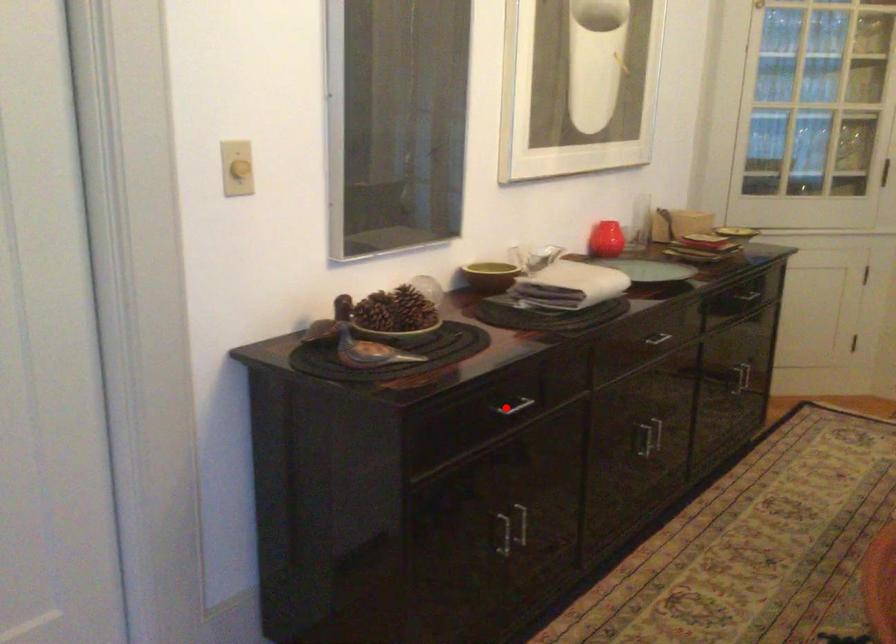
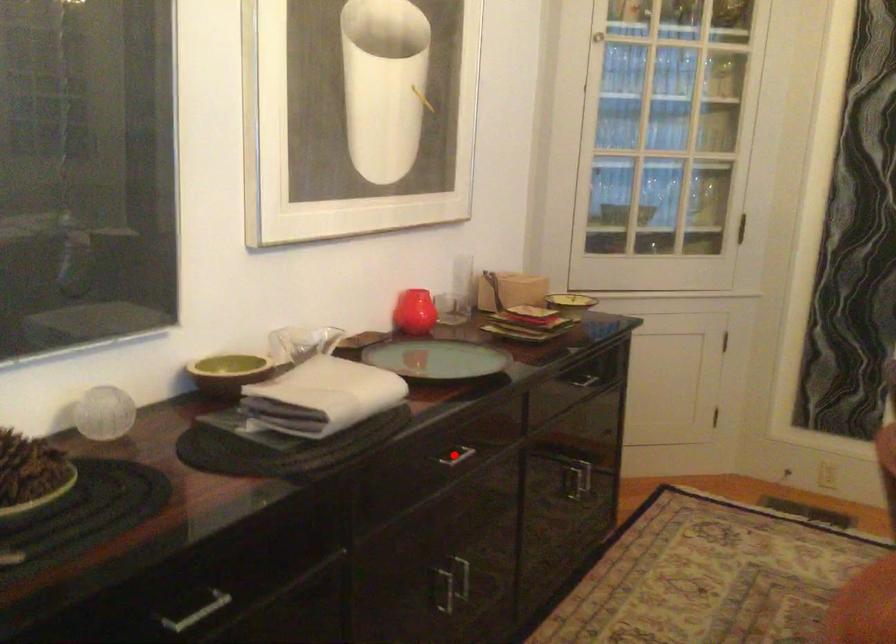
I am providing you with two images of the same scene from different viewpoints. A red point is marked on the first image and another point is marked on the second image. Do the highlighted points in image1 and image2 indicate the same real-world spot?

No